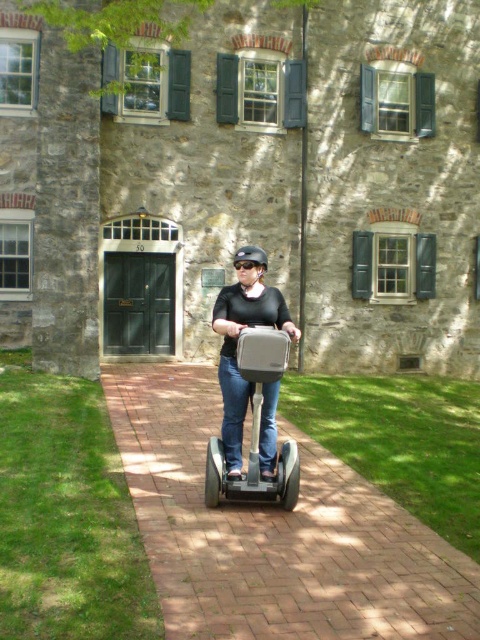
Question: Among these objects, which one is farthest from the camera?

Choices:
 (A) black matte helmet at center
 (B) brick pavement at center
 (C) matte gray scooter at center

Answer: (A)

Question: Estimate the real-world distances between objects in this image. Which object is farther from the brick pavement at center?

Choices:
 (A) black matte helmet at center
 (B) matte gray scooter at center

Answer: (A)

Question: Does brick pavement at center appear over black matte helmet at center?

Choices:
 (A) yes
 (B) no

Answer: (B)

Question: Is brick pavement at center bigger than matte gray scooter at center?

Choices:
 (A) yes
 (B) no

Answer: (B)

Question: Does brick pavement at center appear over matte gray scooter at center?

Choices:
 (A) yes
 (B) no

Answer: (B)

Question: Estimate the real-world distances between objects in this image. Which object is farther from the black matte helmet at center?

Choices:
 (A) matte gray scooter at center
 (B) brick pavement at center

Answer: (B)